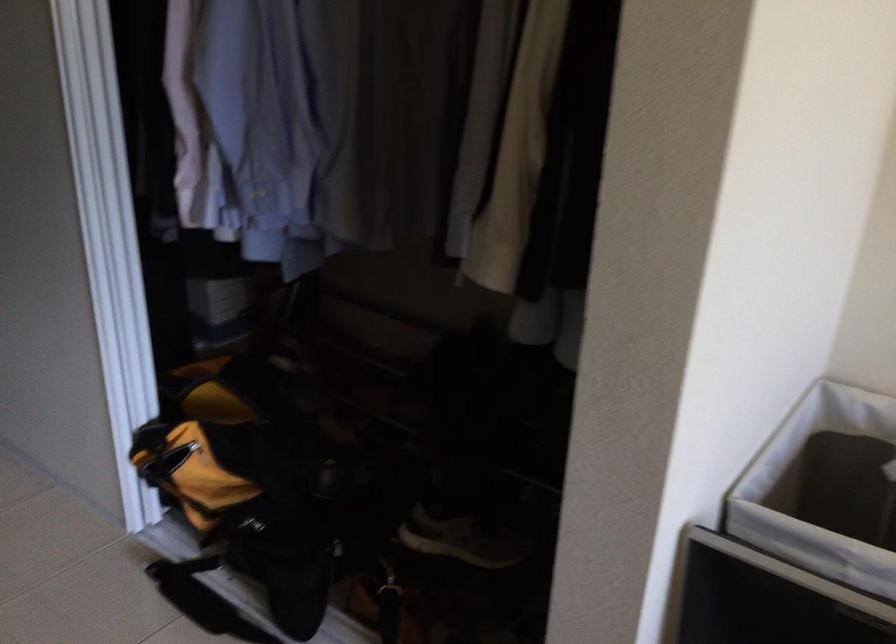
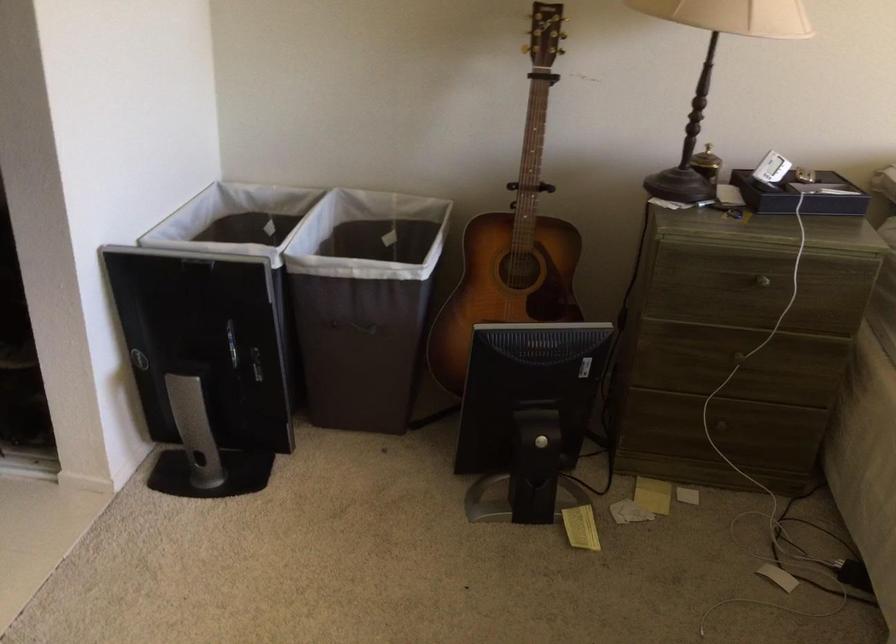
Question: I am providing you with two images of the same scene from different viewpoints. Which of the following objects are not visible in image2?

Choices:
 (A) black bar handle
 (B) black box
 (C) table lamp
 (D) white laundry basket

Answer: (D)